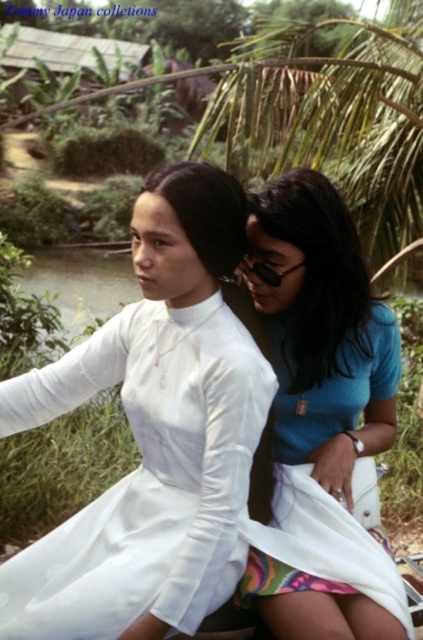
Does white satin dress at center have a smaller size compared to blue matte shirt at center?

Correct, white satin dress at center occupies less space than blue matte shirt at center.

Who is lower down, white satin dress at center or blue matte shirt at center?

white satin dress at center is lower down.

Based on the photo, who is more distant from viewer, (27,417) or (274,417)?

Point (274,417)

This screenshot has height=640, width=423. Identify the location of white satin dress at center. (145, 476).